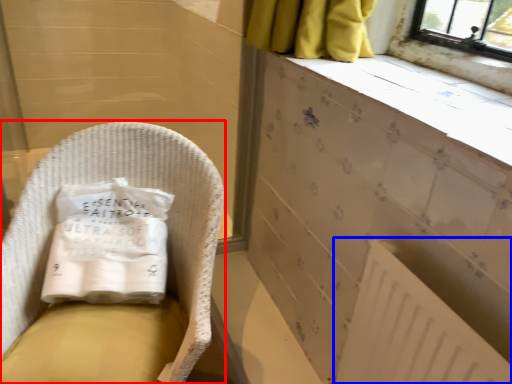
Question: Which of the following is the farthest to the observer, furniture (highlighted by a red box) or radiator (highlighted by a blue box)?

Choices:
 (A) furniture
 (B) radiator

Answer: (A)